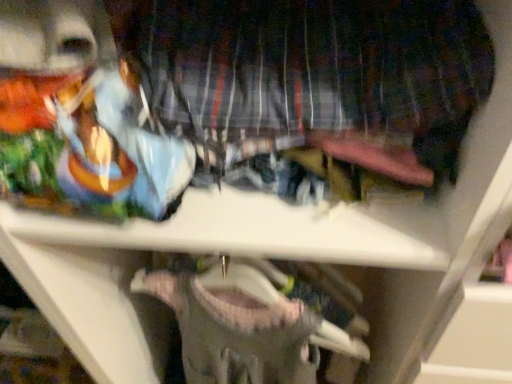
In order to face plaid fabric shirt at center, should I rotate leftwards or rightwards?

It's best to rotate right around 7.260 degrees.

Describe the element at coordinates (306, 64) in the screenshot. I see `plaid fabric shirt at center` at that location.

Locate an element on the screen. This screenshot has width=512, height=384. plaid fabric shirt at center is located at coordinates (306, 64).

Locate an element on the screen. This screenshot has height=384, width=512. plaid fabric shirt at center is located at coordinates (306, 64).